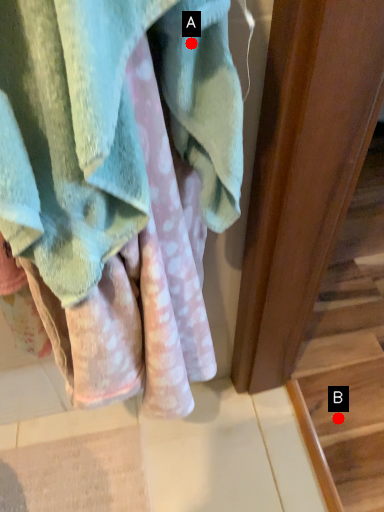
Question: Two points are circled on the image, labeled by A and B beside each circle. Among these points, which one is nearest to the camera?

Choices:
 (A) A is closer
 (B) B is closer

Answer: (A)